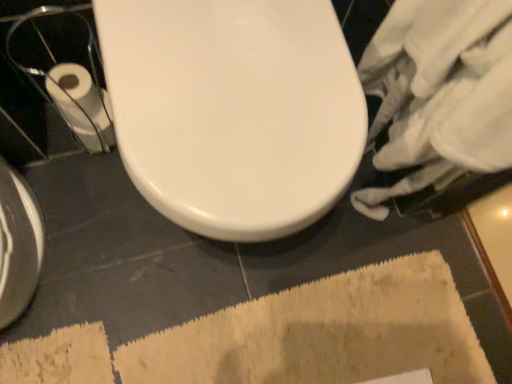
What do you see at coordinates (324, 333) in the screenshot?
I see `beige textured bath mat at lower center` at bounding box center [324, 333].

Image resolution: width=512 pixels, height=384 pixels. Describe the element at coordinates (82, 105) in the screenshot. I see `white paper at left` at that location.

In order to face white glossy toilet at center, should I rotate leftwards or rightwards?

It's best to rotate left around 3.548 degrees.

Locate an element on the screen. beige textured bath mat at lower center is located at coordinates (324, 333).

From a real-world perspective, who is located lower, beige textured bath mat at lower center or white paper at left?

In real-world perspective, beige textured bath mat at lower center is lower.

In the scene shown: In terms of height, does beige textured bath mat at lower center look taller or shorter compared to white paper at left?

beige textured bath mat at lower center is shorter than white paper at left.

Consider the image. Which object is positioned more to the left, beige textured bath mat at lower center or white paper at left?

white paper at left is more to the left.

Measure the distance from white paper at left to beige textured bath mat at lower center.

white paper at left is 25.58 inches away from beige textured bath mat at lower center.

From a real-world perspective, which is physically above, white paper at left or beige textured bath mat at lower center?

In real-world perspective, white paper at left is above.

Does white paper at left have a greater width compared to beige textured bath mat at lower center?

Incorrect, the width of white paper at left does not surpass that of beige textured bath mat at lower center.

Between white paper at left and beige textured bath mat at lower center, which one has smaller size?

white paper at left is smaller.

From the picture: Is white paper at left facing towards white glossy toilet at center?

No, white paper at left is not facing towards white glossy toilet at center.

How many degrees apart are the facing directions of white paper at left and white glossy toilet at center?

5.95 degrees separate the facing orientations of white paper at left and white glossy toilet at center.

Is white paper at left closer to the viewer compared to white glossy toilet at center?

No, the depth of white paper at left is greater than that of white glossy toilet at center.

Can you confirm if white paper at left is thinner than white glossy toilet at center?

Yes, white paper at left is thinner than white glossy toilet at center.

Is beige textured bath mat at lower center looking in the opposite direction of white glossy toilet at center?

beige textured bath mat at lower center is not turned away from white glossy toilet at center.

Which object is wider, beige textured bath mat at lower center or white glossy toilet at center?

beige textured bath mat at lower center.

Is beige textured bath mat at lower center smaller than white glossy toilet at center?

Yes, beige textured bath mat at lower center is smaller than white glossy toilet at center.

Would you say beige textured bath mat at lower center is to the left or to the right of white glossy toilet at center in the picture?

In the image, beige textured bath mat at lower center appears on the right side of white glossy toilet at center.

From a real-world perspective, is white glossy toilet at center located higher than white paper at left?

Yes.

Between white glossy toilet at center and white paper at left, which one appears on the right side from the viewer's perspective?

Positioned to the right is white glossy toilet at center.

How far apart are white glossy toilet at center and white paper at left?

A distance of 16.99 inches exists between white glossy toilet at center and white paper at left.

Is white glossy toilet at center taller or shorter than white paper at left?

Considering their sizes, white glossy toilet at center has more height than white paper at left.

Between white glossy toilet at center and beige textured bath mat at lower center, which one has larger width?

Wider between the two is beige textured bath mat at lower center.

Is white glossy toilet at center inside or outside of beige textured bath mat at lower center?

white glossy toilet at center exists outside the volume of beige textured bath mat at lower center.

Considering the relative positions of white glossy toilet at center and beige textured bath mat at lower center in the image provided, is white glossy toilet at center to the left or to the right of beige textured bath mat at lower center?

white glossy toilet at center is to the left of beige textured bath mat at lower center.

Can you see white glossy toilet at center touching beige textured bath mat at lower center?

No, white glossy toilet at center is not beside beige textured bath mat at lower center.

Image resolution: width=512 pixels, height=384 pixels. In order to click on bath mat in front of the white paper at left in this screenshot , I will do point(324,333).

Where is `toilet paper on the left side of beige textured bath mat at lower center`? toilet paper on the left side of beige textured bath mat at lower center is located at coordinates (82, 105).

Based on their spatial positions, is white glossy toilet at center or beige textured bath mat at lower center further from white paper at left?

beige textured bath mat at lower center is further to white paper at left.

When comparing their distances from white glossy toilet at center, does beige textured bath mat at lower center or white paper at left seem further?

Among the two, beige textured bath mat at lower center is located further to white glossy toilet at center.

Considering their positions, is white paper at left positioned closer to white glossy toilet at center than beige textured bath mat at lower center?

white paper at left is positioned closer to the anchor white glossy toilet at center.

From the image, which object appears to be farther from beige textured bath mat at lower center, white glossy toilet at center or white paper at left?

white paper at left lies further to beige textured bath mat at lower center than the other object.

Based on the photo, from the image, which object appears to be nearer to beige textured bath mat at lower center, white paper at left or white glossy toilet at center?

Among the two, white glossy toilet at center is located nearer to beige textured bath mat at lower center.

Looking at the image, which one is located closer to white paper at left, beige textured bath mat at lower center or white glossy toilet at center?

The object closer to white paper at left is white glossy toilet at center.

Where is `toilet between white paper at left and beige textured bath mat at lower center vertically`? This screenshot has height=384, width=512. toilet between white paper at left and beige textured bath mat at lower center vertically is located at coordinates (234, 110).